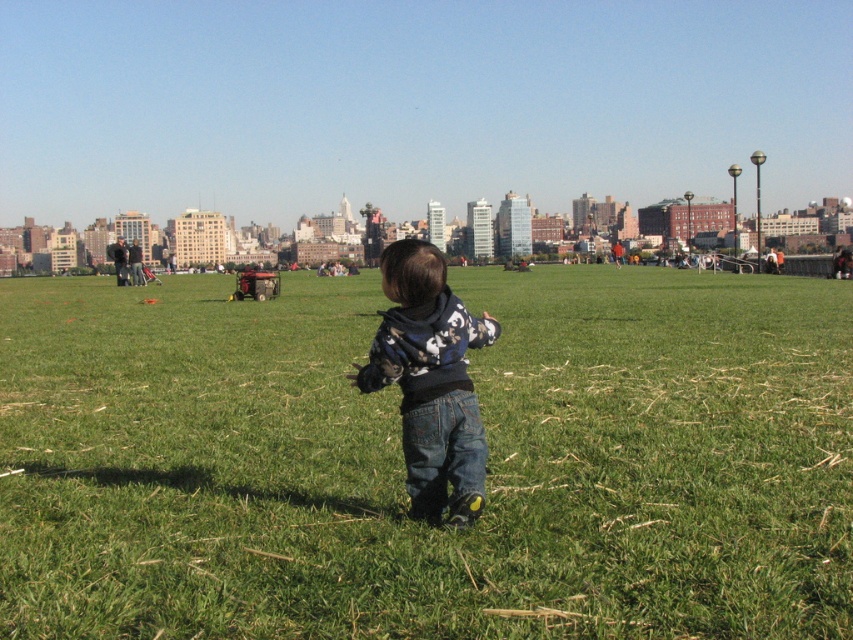
Can you confirm if green grass at center is positioned above denim pants at center?

Actually, green grass at center is below denim pants at center.

Is point (337, 385) closer to viewer compared to point (454, 454)?

That is False.

The image size is (853, 640). I want to click on green grass at center, so click(x=403, y=465).